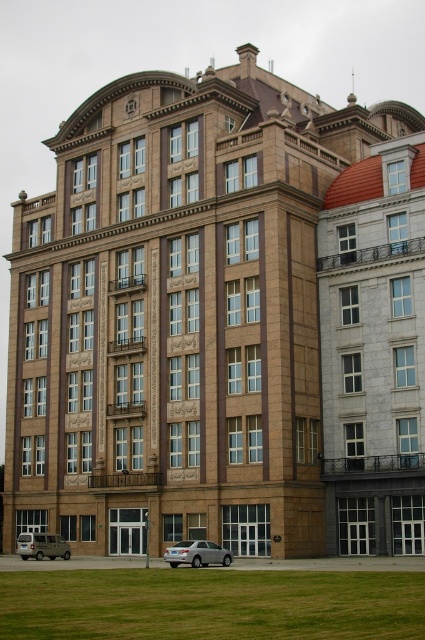
Question: Does green grass at lower center appear under matte silver van at lower left?

Choices:
 (A) yes
 (B) no

Answer: (B)

Question: Which point is farther to the camera?

Choices:
 (A) (354, 314)
 (B) (16, 548)
 (C) (217, 588)

Answer: (B)

Question: Is marble balcony at right closer to camera compared to green grass at lower center?

Choices:
 (A) yes
 (B) no

Answer: (B)

Question: Which point is farther to the camera?

Choices:
 (A) marble balcony at right
 (B) green grass at lower center

Answer: (A)

Question: Does marble balcony at right have a lesser width compared to satin silver sedan at lower center?

Choices:
 (A) yes
 (B) no

Answer: (B)

Question: Which point is closer to the camera taking this photo?

Choices:
 (A) (329, 209)
 (B) (217, 554)
 (C) (64, 540)

Answer: (B)